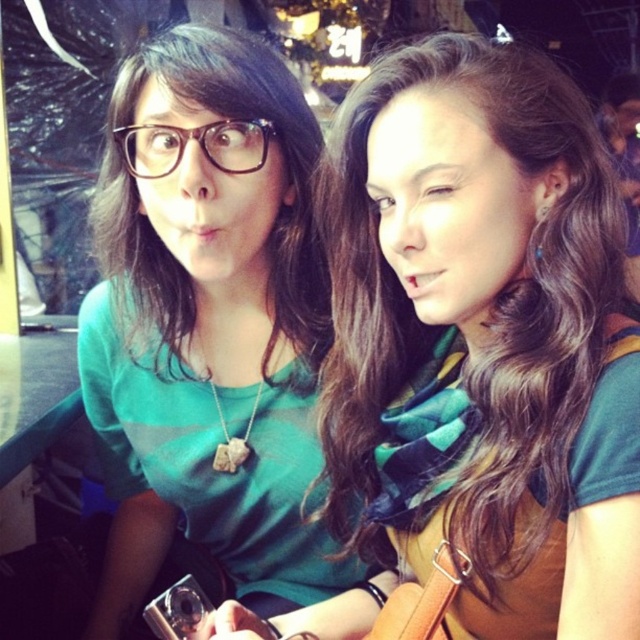
Question: Which object appears closest to the camera in this image?

Choices:
 (A) green matte shirt at left
 (B) green matte shirt at upper left
 (C) black plastic glasses at upper left

Answer: (B)

Question: From the image, what is the correct spatial relationship of green matte shirt at upper left in relation to green matte shirt at left?

Choices:
 (A) below
 (B) above

Answer: (B)

Question: Which object appears closest to the camera in this image?

Choices:
 (A) black plastic glasses at upper left
 (B) green matte shirt at left
 (C) green matte shirt at upper left

Answer: (C)

Question: Among these points, which one is nearest to the camera?

Choices:
 (A) (291, 74)
 (B) (161, 148)
 (C) (499, 468)

Answer: (C)

Question: Can you confirm if green matte shirt at left is smaller than black plastic glasses at upper left?

Choices:
 (A) no
 (B) yes

Answer: (A)

Question: Is green matte shirt at left smaller than black plastic glasses at upper left?

Choices:
 (A) no
 (B) yes

Answer: (A)